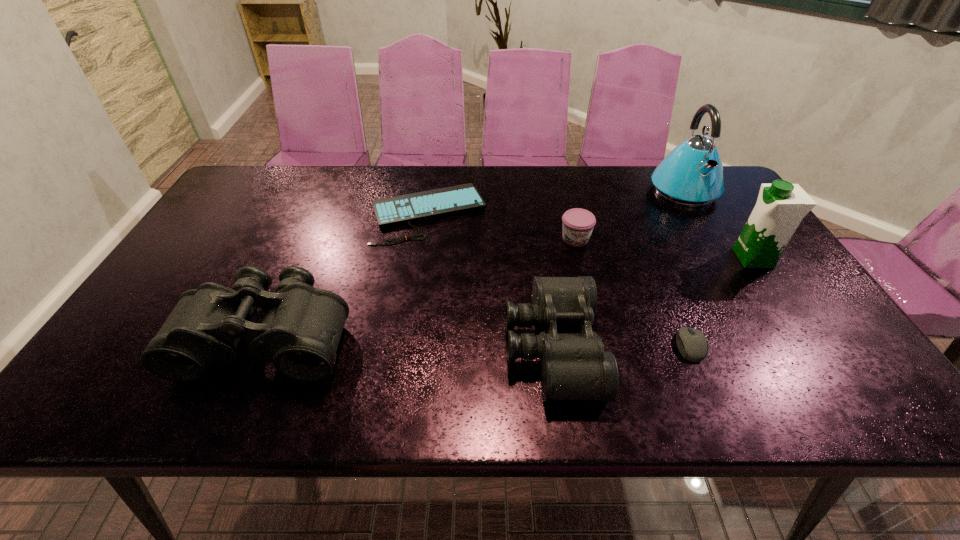
The width and height of the screenshot is (960, 540). Find the location of `vacant space situated 0.390m at the eyepieces of the shorter binoculars`. vacant space situated 0.390m at the eyepieces of the shorter binoculars is located at coordinates (772, 347).

Identify the location of free space located 0.140m at the spout of the tallest object. The width and height of the screenshot is (960, 540). (713, 240).

The height and width of the screenshot is (540, 960). I want to click on vacant position located on the right of the computer keyboard, so click(x=597, y=212).

Image resolution: width=960 pixels, height=540 pixels. What are the coordinates of `vacant space situated 0.160m on the front label of the jam` in the screenshot? It's located at (588, 291).

At what (x,y) coordinates should I click in order to perform the action: click on vacant area located 0.390m on the front-facing side of the soya milk. Please return your answer as a coordinate pair (x, y). The image size is (960, 540). Looking at the image, I should click on (590, 258).

You are a GUI agent. You are given a task and a screenshot of the screen. Output one action in this format:
    pyautogui.click(x=<x>, y=<y>)
    Task: Click on the free space located on the front-facing side of the soya milk
    
    Given the screenshot: What is the action you would take?
    pyautogui.click(x=667, y=258)

Find the location of a particular element. The width and height of the screenshot is (960, 540). free location located on the front-facing side of the soya milk is located at coordinates (649, 258).

Find the location of a particular element. This screenshot has height=540, width=960. blank area located on the right of the computer equipment is located at coordinates (783, 346).

Identify the location of kettle situated at the far edge. The image size is (960, 540). (691, 175).

In order to click on computer keyboard situated at the far edge in this screenshot , I will do `click(412, 207)`.